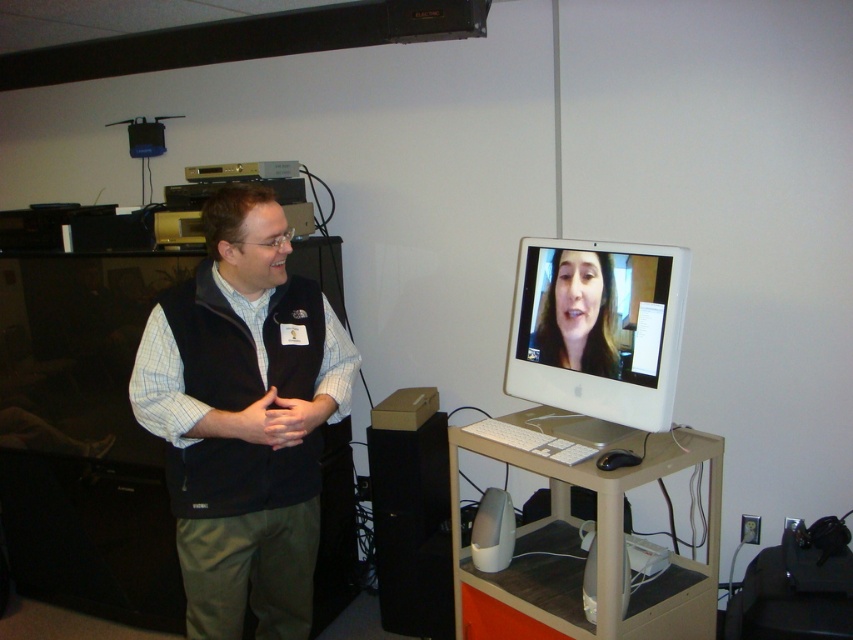
Question: Does black fleece vest at left appear under white glossy computer monitor at center?

Choices:
 (A) no
 (B) yes

Answer: (B)

Question: Which point is farther to the camera?

Choices:
 (A) smooth skin face at center
 (B) white glossy computer monitor at center
 (C) black fleece vest at left
 (D) beige plastic computer desk at lower center

Answer: (A)

Question: Is beige plastic computer desk at lower center to the left of smooth skin face at center from the viewer's perspective?

Choices:
 (A) yes
 (B) no

Answer: (B)

Question: Does black fleece vest at left have a lesser width compared to smooth skin face at center?

Choices:
 (A) yes
 (B) no

Answer: (B)

Question: Which of the following is the closest to the observer?

Choices:
 (A) (695, 573)
 (B) (553, 324)
 (C) (183, 378)
 (D) (587, 298)

Answer: (C)

Question: Which of the following is the closest to the observer?

Choices:
 (A) beige plastic computer desk at lower center
 (B) white glossy computer monitor at center

Answer: (A)